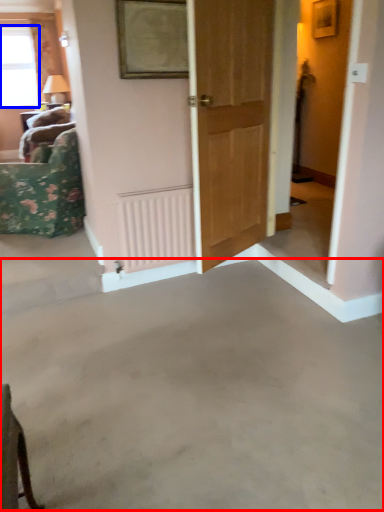
Question: Which of the following is the farthest to the observer, concrete (highlighted by a red box) or window (highlighted by a blue box)?

Choices:
 (A) concrete
 (B) window

Answer: (B)